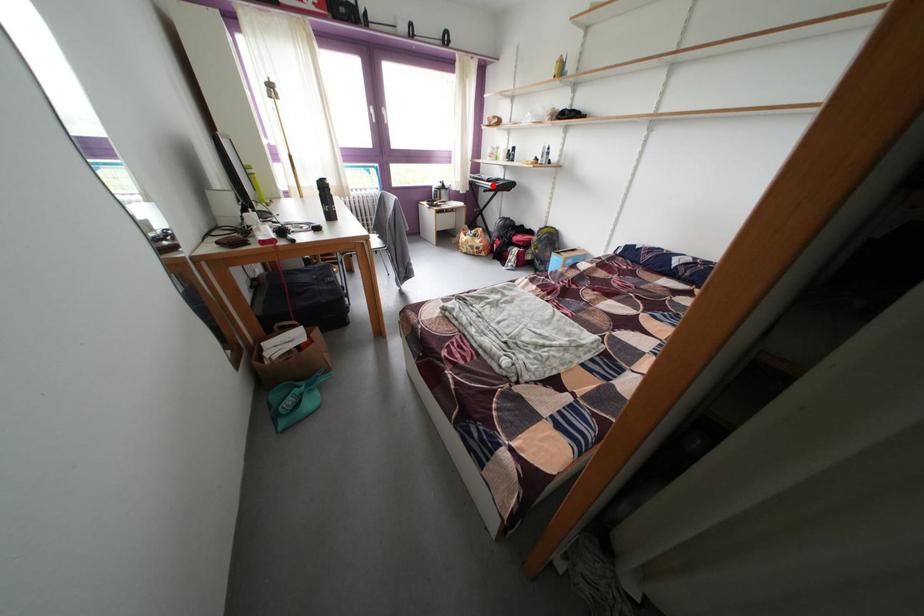
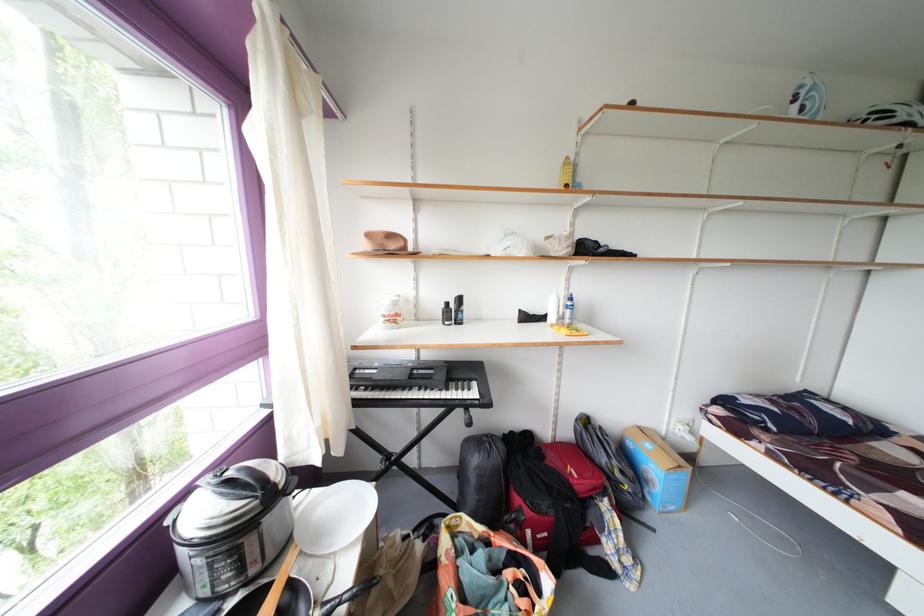
Question: I am providing you with two images of the same scene from different viewpoints. A red point is marked on the first image. Is the red point's position out of view in image 2?

Choices:
 (A) Yes
 (B) No

Answer: (B)